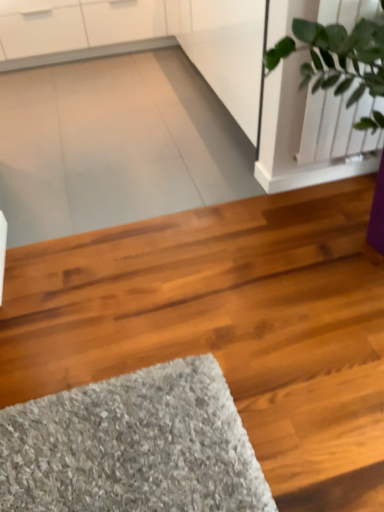
Locate an element on the screen. Image resolution: width=384 pixels, height=512 pixels. vacant region below green leafy plant at upper right (from a real-world perspective) is located at coordinates (329, 182).